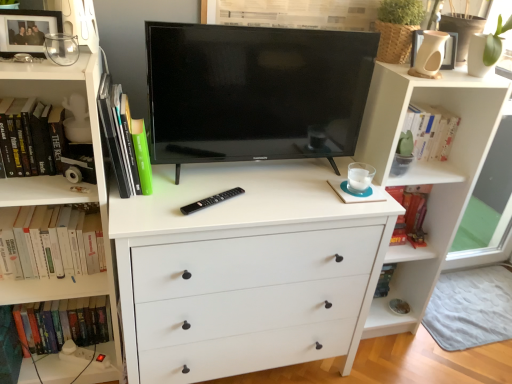
Locate an element on the screen. The width and height of the screenshot is (512, 384). vacant area that lies between black plastic remote control at center and green matte book at left, the 3th book positioned from the bottom is located at coordinates (177, 194).